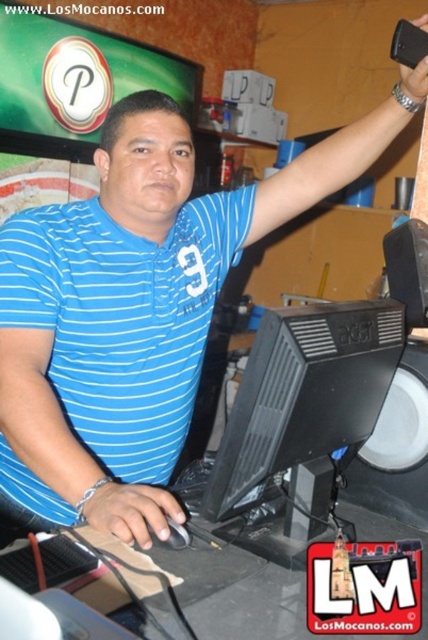
You are a customer trying to see the menu displayed on the black plastic monitor at center while standing in front of the counter. However, the man in the blue striped polo shirt at center is blocking your view. Can you walk around him to see the monitor?

The blue striped polo shirt at center is further to the viewer than the black plastic monitor at center, so the man is closer to you. You can walk around him to see the monitor behind him.

Where is the blue striped polo shirt at center located in the image?

The blue striped polo shirt at center is located at point [122,317].

You are a customer in a cafe and you want to check if the employee is available. You see the blue striped polo shirt at center and the black plastic monitor at center. Which object is closer to you?

The blue striped polo shirt at center is positioned over the black plastic monitor at center, meaning it is closer to you.